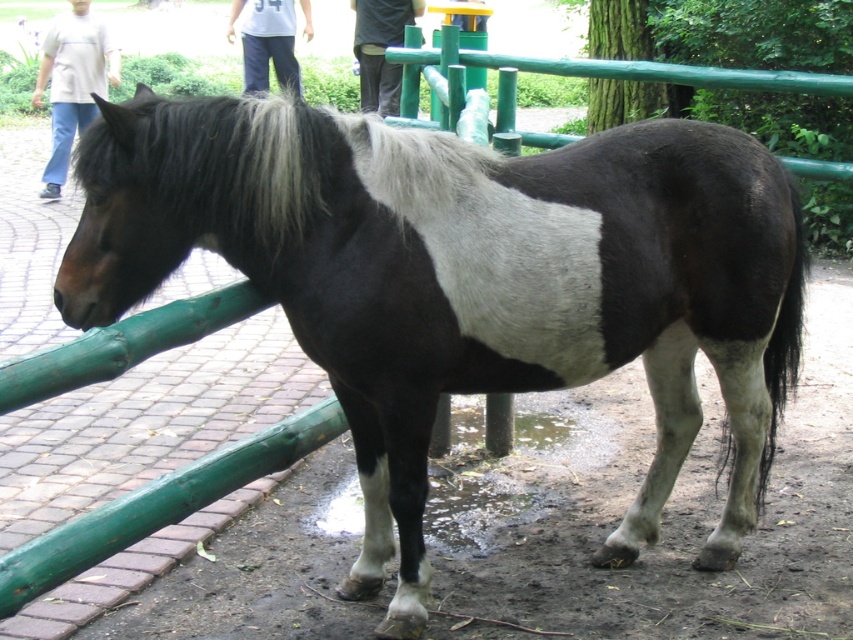
You are a photographer trying to capture a closeup shot of the black silky mane at upper left and the white cotton shirt at upper left. Given that your camera has a minimum focusing distance of 5 meters, will you be able to take the photo without moving closer?

The distance between the black silky mane at upper left and the white cotton shirt at upper left is 7.39 meters. Since your camera requires a minimum of 5 meters to focus, you can take the photo without moving closer because the distance is sufficient.

You are standing 2 meters away from the horse and want to move to the point marked as point (459, 212). Will you be able to reach that point without moving closer than 2 meters to the horse?

The distance of point (459, 212) from the viewer is 2.87 meters, so moving to that point would require being 2.87 meters away from the horse, which is farther than your current 2 meters. Therefore, you can reach the point without moving closer than 2 meters to the horse.